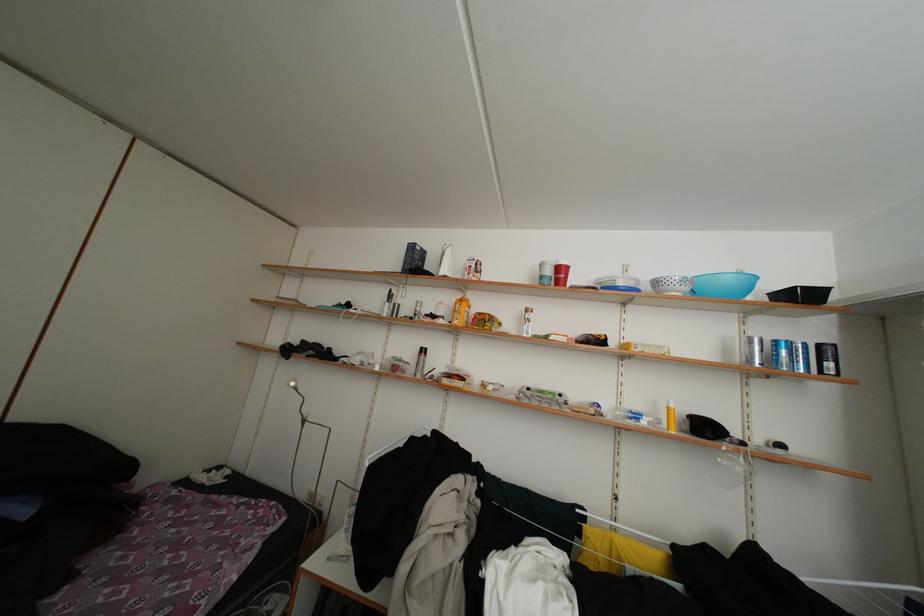
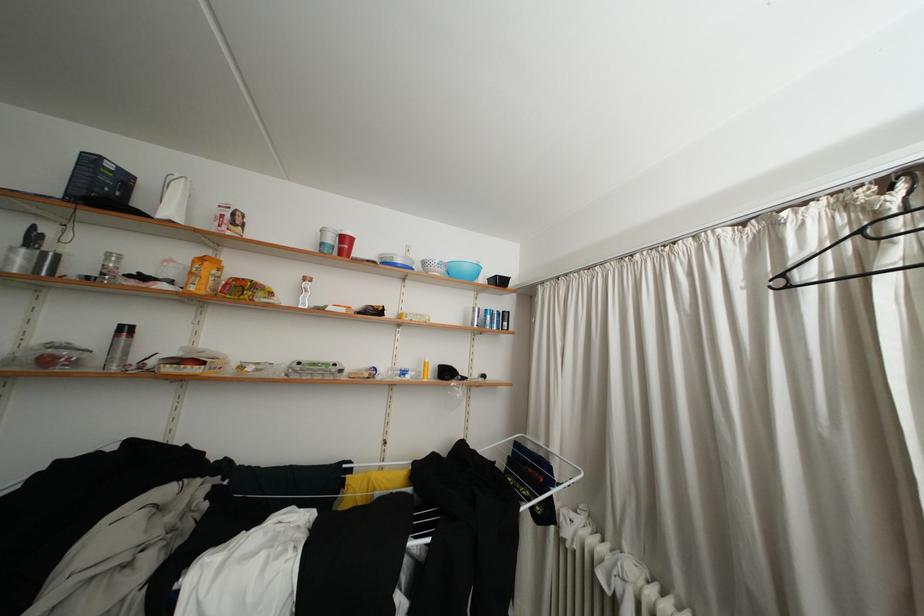
The point at (430, 353) is marked in the first image. Where is the corresponding point in the second image?

(129, 331)